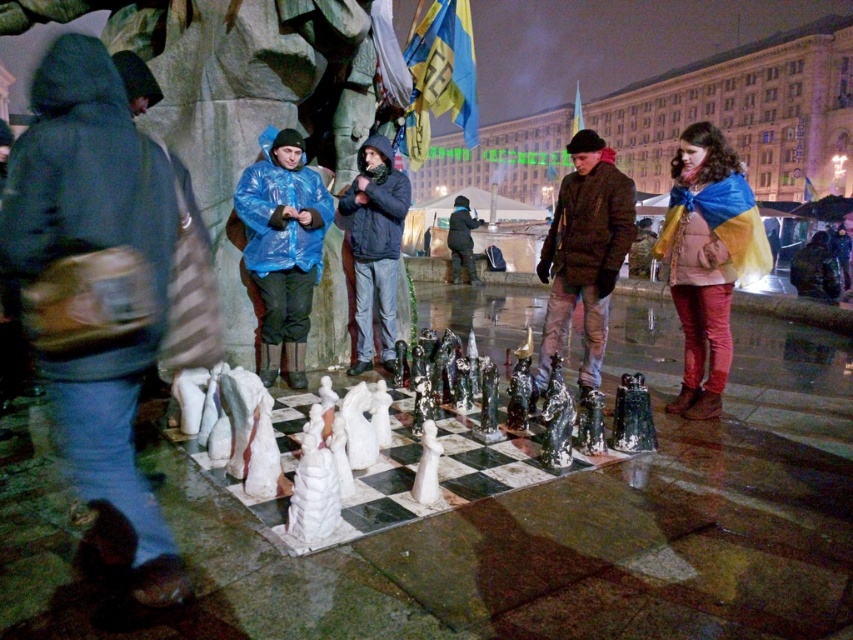
Question: Is dark blue hooded jacket at center thinner than blue plastic bag at center?

Choices:
 (A) yes
 (B) no

Answer: (B)

Question: Can you confirm if blue plastic raincoat at center is positioned to the right of blue plastic bag at center?

Choices:
 (A) yes
 (B) no

Answer: (B)

Question: Which point is farther to the camera?

Choices:
 (A) matte blue raincoat at center
 (B) brown textured jacket at center
 (C) blue plastic raincoat at center

Answer: (A)

Question: Among these points, which one is farthest from the camera?

Choices:
 (A) (349, 198)
 (B) (33, 228)
 (C) (602, 211)
 (D) (460, 195)

Answer: (D)

Question: Is dark blue hooded jacket at center positioned before blue and yellow fabric draped at center?

Choices:
 (A) yes
 (B) no

Answer: (A)

Question: Which point is farther to the camera?

Choices:
 (A) matte blue raincoat at center
 (B) blue plastic raincoat at center
 (C) blue plastic bag at center

Answer: (A)